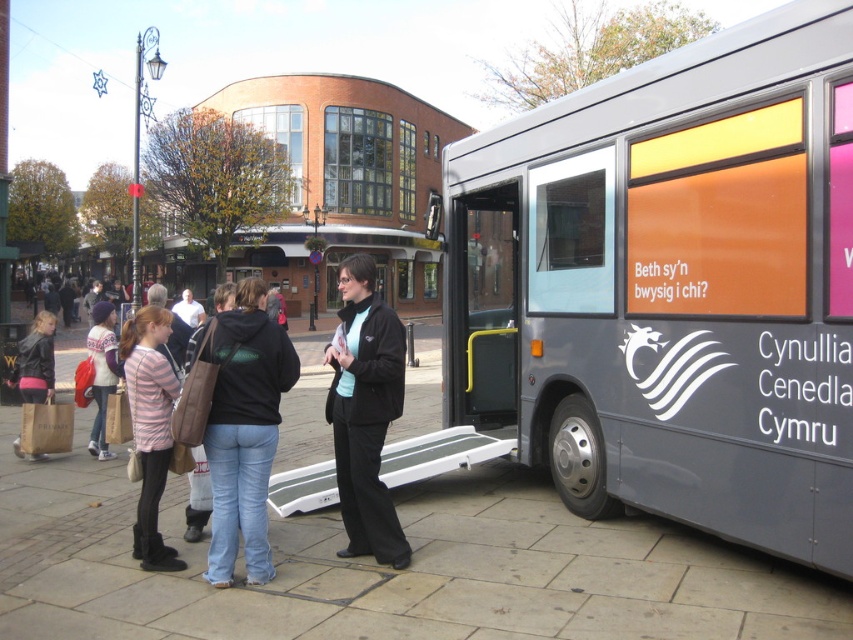
Does black matte jacket at center appear under striped cotton shirt at center?

Yes, black matte jacket at center is below striped cotton shirt at center.

From the picture: Does black matte jacket at center have a lesser height compared to striped cotton shirt at center?

No.

You are a GUI agent. You are given a task and a screenshot of the screen. Output one action in this format:
    pyautogui.click(x=<x>, y=<y>)
    Task: Click on the black matte jacket at center
    This screenshot has height=640, width=853.
    Given the screenshot: What is the action you would take?
    pyautogui.click(x=364, y=413)

Does silver metallic bus at right have a lesser height compared to denim jeans at center?

No.

The image size is (853, 640). In order to click on silver metallic bus at right in this screenshot , I will do `click(671, 285)`.

The height and width of the screenshot is (640, 853). What do you see at coordinates (671, 285) in the screenshot?
I see `silver metallic bus at right` at bounding box center [671, 285].

The image size is (853, 640). Identify the location of silver metallic bus at right. (671, 285).

The height and width of the screenshot is (640, 853). Describe the element at coordinates (242, 426) in the screenshot. I see `denim jeans at center` at that location.

Where is `denim jeans at center`? The width and height of the screenshot is (853, 640). denim jeans at center is located at coordinates (242, 426).